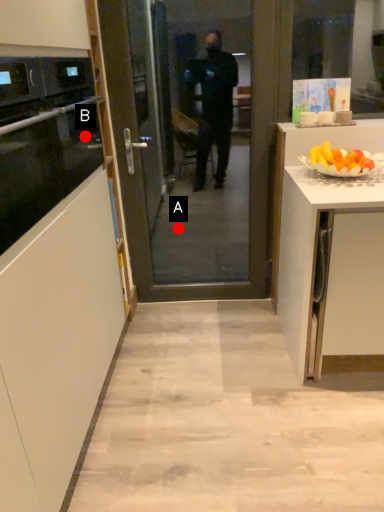
Question: Two points are circled on the image, labeled by A and B beside each circle. Among these points, which one is farthest from the camera?

Choices:
 (A) A is further
 (B) B is further

Answer: (A)